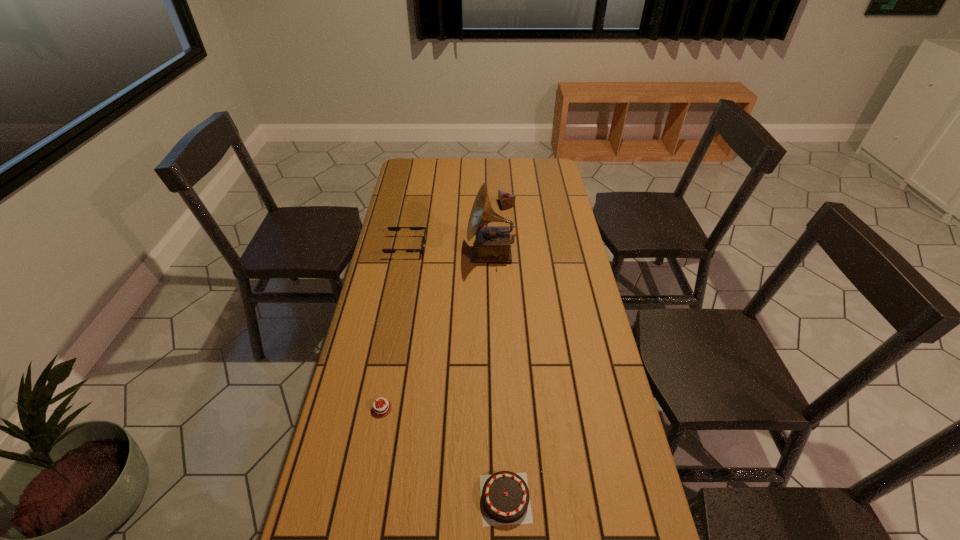
Locate an element on the screen. The width and height of the screenshot is (960, 540). free region located on the horn of the phonograph record is located at coordinates (445, 253).

You are a GUI agent. You are given a task and a screenshot of the screen. Output one action in this format:
    pyautogui.click(x=<x>, y=<y>)
    Task: Click on the free space located on the right of the fourth shortest object
    
    Given the screenshot: What is the action you would take?
    pyautogui.click(x=531, y=205)

In order to click on free location located on the temples of the sunglasses in this screenshot , I will do `click(505, 247)`.

Locate an element on the screen. The height and width of the screenshot is (540, 960). vacant space located 0.370m on the left of the nearest chocolate cake is located at coordinates (320, 498).

Locate an element on the screen. Image resolution: width=960 pixels, height=540 pixels. vacant area situated 0.060m on the left of the shortest object is located at coordinates (340, 408).

This screenshot has width=960, height=540. In order to click on sunglasses situated at the left edge in this screenshot , I will do `click(389, 228)`.

Image resolution: width=960 pixels, height=540 pixels. I want to click on chocolate cake located at the left edge, so click(379, 408).

In the image, there is a desktop. Where is `vacant area at the far edge`? vacant area at the far edge is located at coordinates (437, 170).

The height and width of the screenshot is (540, 960). I want to click on vacant space at the left edge of the desktop, so click(x=330, y=498).

In the image, there is a desktop. Where is `free region at the right edge`? The height and width of the screenshot is (540, 960). free region at the right edge is located at coordinates (538, 228).